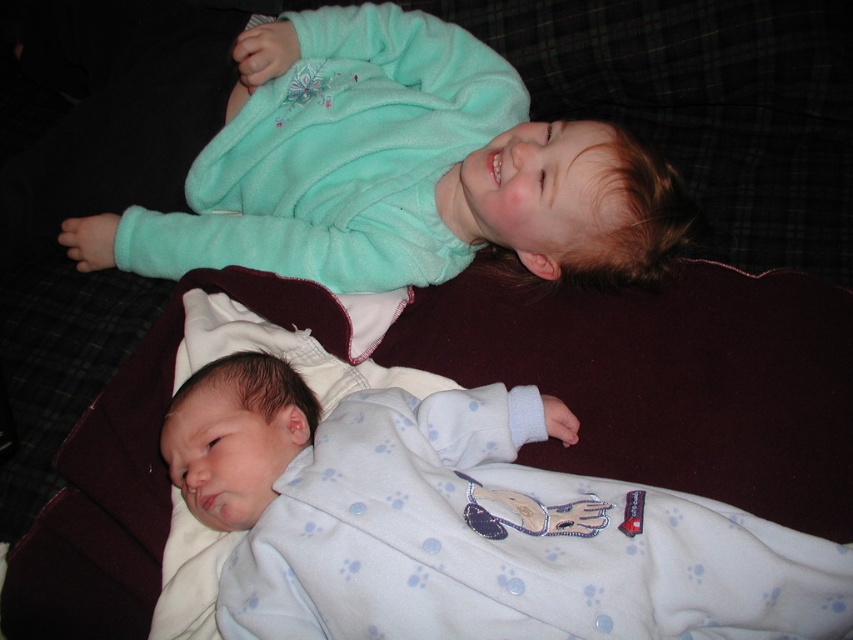
Is white soft bed at upper center taller than teal fleece jacket at upper center?

In fact, white soft bed at upper center may be shorter than teal fleece jacket at upper center.

Does white soft bed at upper center have a lesser height compared to teal fleece jacket at upper center?

Correct, white soft bed at upper center is not as tall as teal fleece jacket at upper center.

Locate an element on the screen. This screenshot has width=853, height=640. white soft bed at upper center is located at coordinates (666, 378).

At what (x,y) coordinates should I click in order to perform the action: click on white soft bed at upper center. Please return your answer as a coordinate pair (x, y). Looking at the image, I should click on (666, 378).

Between point (764, 301) and point (650, 570), which one is positioned behind?

The point (764, 301) is more distant.

Looking at this image, who is taller, white soft bed at upper center or white fleece blanket at lower left?

white soft bed at upper center

Is point (456, 355) in front of point (360, 481)?

No, it is behind (360, 481).

Find the location of a particular element. The width and height of the screenshot is (853, 640). white soft bed at upper center is located at coordinates (666, 378).

Can you confirm if white fleece blanket at lower left is positioned to the right of teal fleece jacket at upper center?

Yes, white fleece blanket at lower left is to the right of teal fleece jacket at upper center.

Is point (735, 621) farther from camera compared to point (459, 77)?

No, it is in front of (459, 77).

The width and height of the screenshot is (853, 640). I want to click on white fleece blanket at lower left, so click(x=508, y=541).